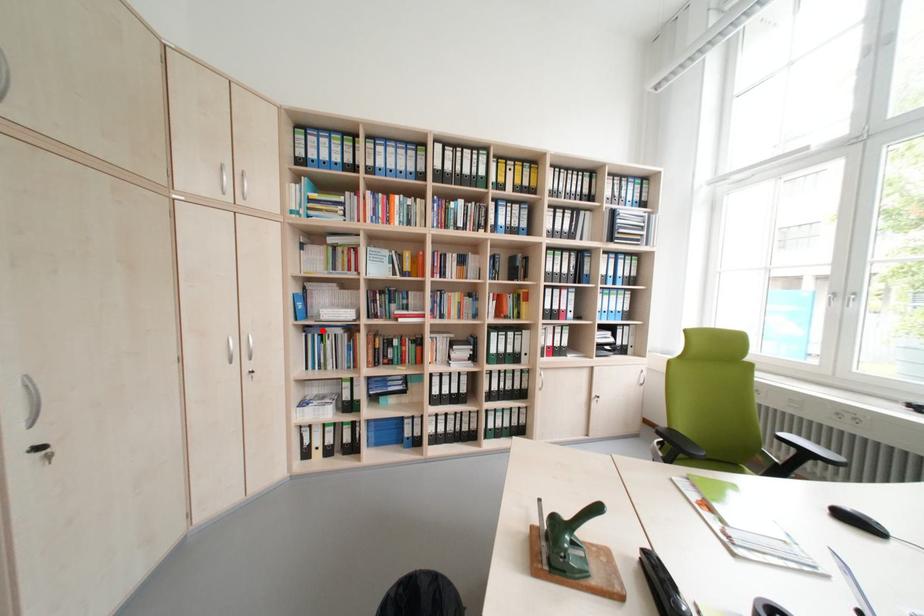
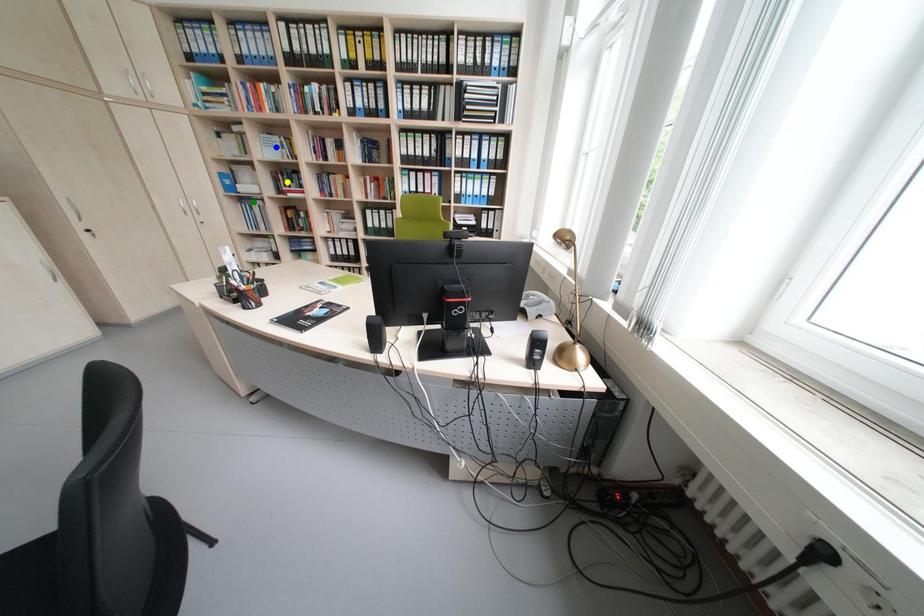
Question: I am providing you with two images of the same scene from different viewpoints. A red point is marked on the first image. You are given multiple points on the second image. Which spot in image 2 lines up with the point in image 1?

Choices:
 (A) green point
 (B) blue point
 (C) yellow point

Answer: (A)